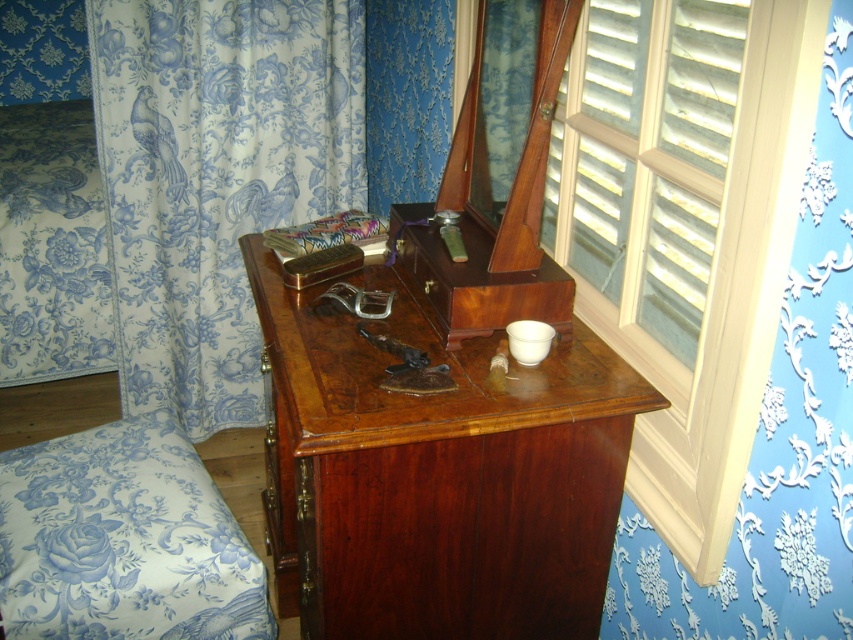
Can you confirm if blue printed fabric at left is thinner than blue floral fabric armchair at lower left?

No.

Which of these two, blue printed fabric at left or blue floral fabric armchair at lower left, stands taller?

With more height is blue printed fabric at left.

Does point (222, 252) come closer to viewer compared to point (54, 600)?

No, it is behind (54, 600).

Find the location of a particular element. The height and width of the screenshot is (640, 853). blue printed fabric at left is located at coordinates (215, 177).

Does mahogany wood dresser at center appear on the left side of blue floral fabric armchair at lower left?

In fact, mahogany wood dresser at center is to the right of blue floral fabric armchair at lower left.

Which is more to the right, mahogany wood dresser at center or blue floral fabric armchair at lower left?

From the viewer's perspective, mahogany wood dresser at center appears more on the right side.

Which is in front, point (300, 516) or point (78, 436)?

Positioned in front is point (300, 516).

Locate an element on the screen. mahogany wood dresser at center is located at coordinates (434, 472).

This screenshot has width=853, height=640. What do you see at coordinates (434, 472) in the screenshot? I see `mahogany wood dresser at center` at bounding box center [434, 472].

Who is shorter, mahogany wood dresser at center or blue printed fabric at left?

Standing shorter between the two is mahogany wood dresser at center.

What do you see at coordinates (434, 472) in the screenshot? I see `mahogany wood dresser at center` at bounding box center [434, 472].

This screenshot has width=853, height=640. Find the location of `mahogany wood dresser at center`. mahogany wood dresser at center is located at coordinates (434, 472).